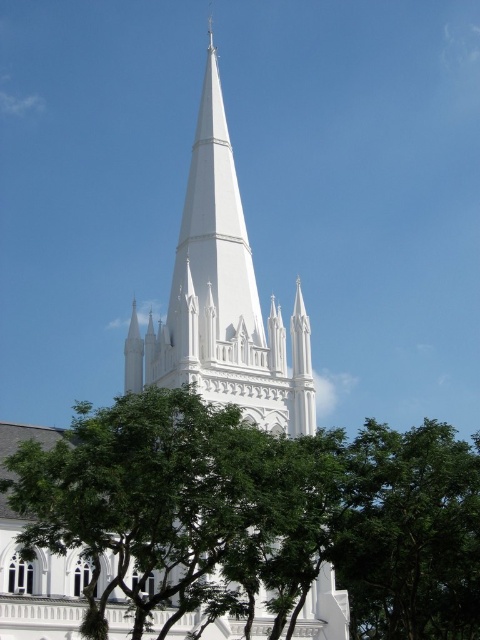
Who is positioned more to the left, green leafy tree at lower left or green leafy tree at lower right?

green leafy tree at lower left

Is point (167, 413) less distant than point (442, 432)?

Yes, it is.

Is point (325, 508) farther from viewer compared to point (472, 492)?

That is False.

Identify the location of green leafy tree at lower left. Image resolution: width=480 pixels, height=640 pixels. (160, 515).

Which is below, green leafy tree at lower left or white stone church steeple at center?

Positioned lower is green leafy tree at lower left.

Can you confirm if green leafy tree at lower left is shorter than white stone church steeple at center?

Yes, green leafy tree at lower left is shorter than white stone church steeple at center.

Find the location of `green leafy tree at lower left`. green leafy tree at lower left is located at coordinates (160, 515).

Consider the image. Is green leafy tree at lower right wider than white smooth spire at center?

Yes.

You are a GUI agent. You are given a task and a screenshot of the screen. Output one action in this format:
    pyautogui.click(x=<x>, y=<y>)
    Task: Click on the green leafy tree at lower right
    The height and width of the screenshot is (640, 480).
    Given the screenshot: What is the action you would take?
    pyautogui.click(x=411, y=534)